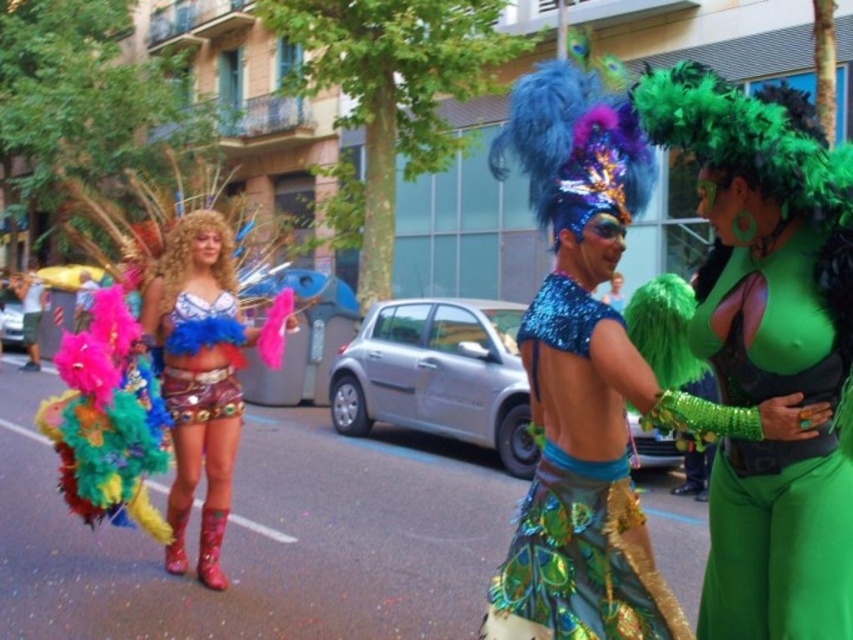
You are a photographer trying to capture the details of the green sequined top at center and the shiny blue sequins at center. Which one appears larger in your camera viewfinder?

The green sequined top at center appears larger in the camera viewfinder because it is closer to the viewer than the shiny blue sequins at center.

You are a photographer standing at the back of the crowd, wanting to capture a photo of both the shiny blue sequin headdress at upper right and the shiny metallic shorts at center. The camera you have can focus on objects within a 2.5 meter range. Can you fit both objects in the same frame without moving closer?

The distance between the shiny blue sequin headdress at upper right and the shiny metallic shorts at center is 2.30 meters. Since your camera can focus on objects within a 2.5 meter range, you can fit both objects in the same frame without moving closer.

Consider the image. Looking at the festive parade scene, there are two items at the center of the image. One is the green sequined top at center and the other is the shiny blue sequins at center. Which one is positioned to the right?

The green sequined top at center is to the right of the shiny blue sequins at center.